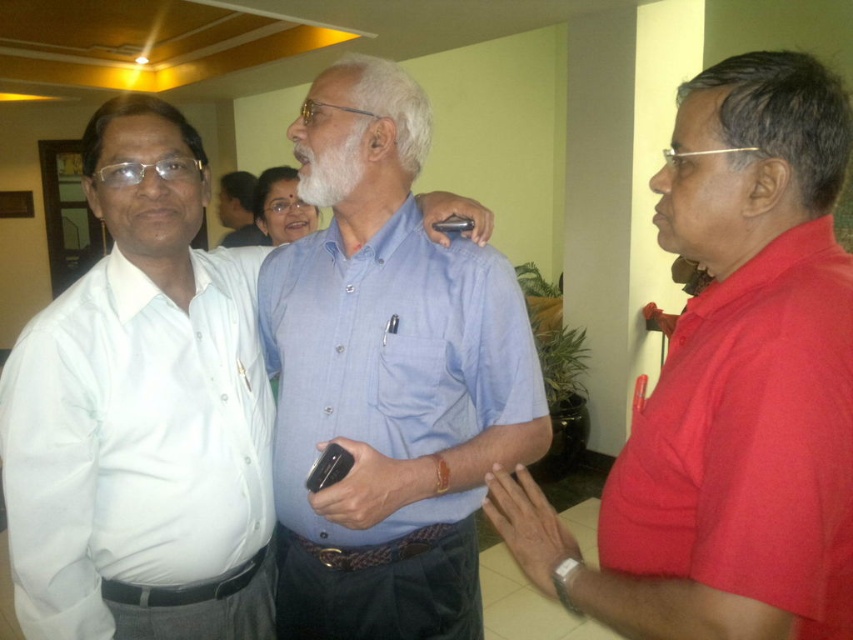
Question: Which object is the closest to the light brown hair at upper center?

Choices:
 (A) whitehairbeard at center
 (B) red matte shirt at right
 (C) red cotton shirt at right

Answer: (A)

Question: Based on their relative distances, which object is nearer to the white cotton shirt at left?

Choices:
 (A) matte blue shirt at center
 (B) light brown hair at upper center
 (C) red cotton shirt at right

Answer: (A)

Question: Which point appears closest to the camera in this image?

Choices:
 (A) (x=233, y=621)
 (B) (x=502, y=348)

Answer: (B)

Question: Can you confirm if blue cotton shirt at center is wider than light brown hair at upper center?

Choices:
 (A) yes
 (B) no

Answer: (A)

Question: Is white cotton shirt at left bigger than blue cotton shirt at center?

Choices:
 (A) yes
 (B) no

Answer: (A)

Question: From the image, what is the correct spatial relationship of white cotton shirt at left in relation to blue cotton shirt at center?

Choices:
 (A) right
 (B) left

Answer: (B)